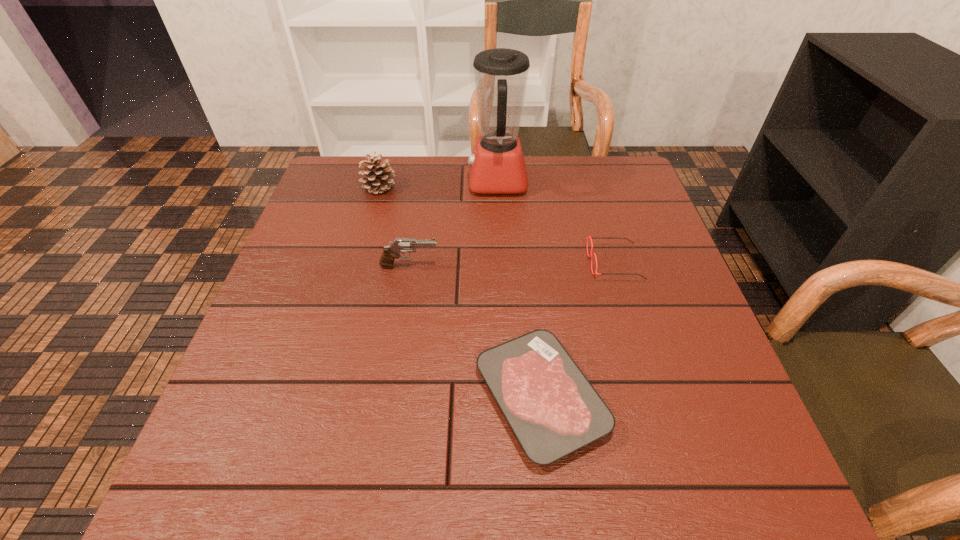
This screenshot has width=960, height=540. Find the location of `object that stands as the fourth closest to the pistol`. object that stands as the fourth closest to the pistol is located at coordinates (591, 255).

Locate which object ranks in proximity to the tallest object. Please provide its 2D coordinates. Your answer should be formatted as a tuple, i.e. [(x, y)], where the tuple contains the x and y coordinates of a point satisfying the conditions above.

[(379, 175)]

Identify the location of free point that satisfies the following two spatial constraints: 1. at the barrel of the shortest object; 2. on the left side of the fourth object from right to left. The image size is (960, 540). (388, 398).

Where is `vacant space that satisfies the following two spatial constraints: 1. on the back side of the steak; 2. on the front of the tallest object near the controls`? Image resolution: width=960 pixels, height=540 pixels. vacant space that satisfies the following two spatial constraints: 1. on the back side of the steak; 2. on the front of the tallest object near the controls is located at coordinates (517, 182).

Locate an element on the screen. vacant space that satisfies the following two spatial constraints: 1. on the back side of the nearest object; 2. on the front of the blender near the controls is located at coordinates (517, 182).

Where is `free location that satisfies the following two spatial constraints: 1. at the barrel of the fourth object from right to left; 2. on the back side of the nearest object`? The height and width of the screenshot is (540, 960). free location that satisfies the following two spatial constraints: 1. at the barrel of the fourth object from right to left; 2. on the back side of the nearest object is located at coordinates (388, 398).